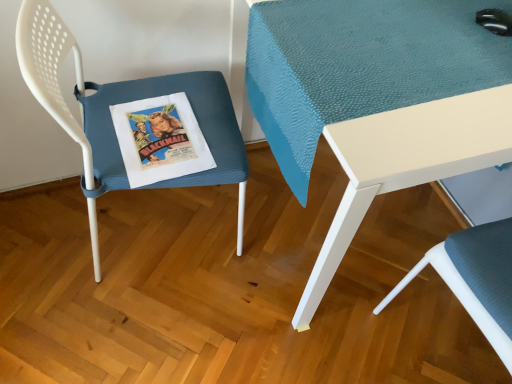
In order to click on vacant space in textured blue cushion at lower right, placed as the second chair when sorted from left to right (from a real-world perspective) in this screenshot , I will do `click(444, 338)`.